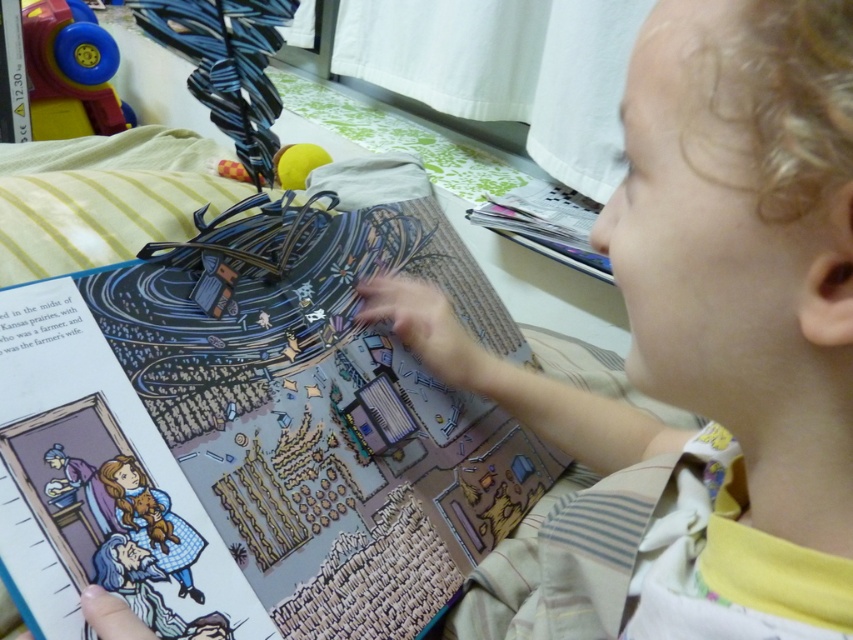
Is point (126, 563) closer to viewer compared to point (73, 13)?

Yes, it is in front of point (73, 13).

Between colorful paper comic book at center and rubberized plastic toy at upper left, which one appears on the right side from the viewer's perspective?

From the viewer's perspective, colorful paper comic book at center appears more on the right side.

Measure the distance between colorful paper comic book at center and camera.

The distance of colorful paper comic book at center from camera is 16.40 inches.

I want to click on colorful paper comic book at center, so click(279, 432).

Is point (804, 280) positioned after point (71, 68)?

No.

Does point (825, 509) come farther from viewer compared to point (73, 84)?

No, (825, 509) is closer to viewer.

Find the location of a particular element. smooth beige shirt at center is located at coordinates (697, 349).

Between smooth beige shirt at center and colorful paper comic book at center, which one is positioned higher?

smooth beige shirt at center is higher up.

Does smooth beige shirt at center have a greater width compared to colorful paper comic book at center?

Incorrect, smooth beige shirt at center's width does not surpass colorful paper comic book at center's.

Between point (630, 97) and point (302, 545), which one is positioned in front?

Point (630, 97)

Find the location of `smooth beige shirt at center`. smooth beige shirt at center is located at coordinates (697, 349).